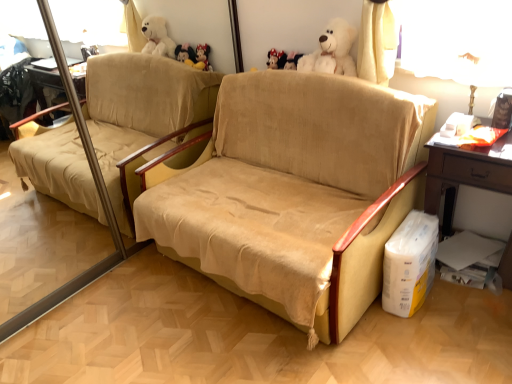
This screenshot has width=512, height=384. In order to click on vacant space to the right of white cardboard box at lower right in this screenshot , I will do `click(462, 301)`.